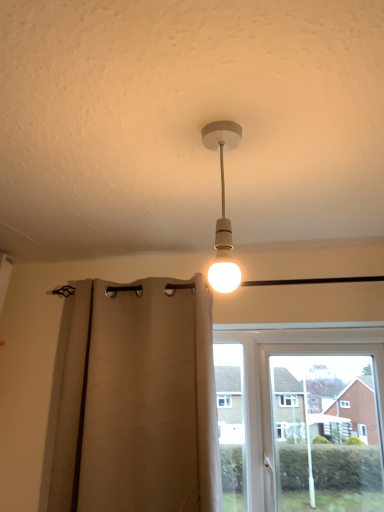
Describe the element at coordinates (308, 415) in the screenshot. This screenshot has height=512, width=384. I see `white plastic window at center` at that location.

Where is `beige fabric curtain at center`? Image resolution: width=384 pixels, height=512 pixels. beige fabric curtain at center is located at coordinates (137, 401).

You are a GUI agent. You are given a task and a screenshot of the screen. Output one action in this format:
    pyautogui.click(x=<x>, y=<y>)
    Task: Click on the white matte bulb at center
    
    Given the screenshot: What is the action you would take?
    pyautogui.click(x=223, y=209)

Is beige fabric curtain at center shorter than white plastic window at center?

Incorrect, the height of beige fabric curtain at center does not fall short of that of white plastic window at center.

Identify the location of window below the beige fabric curtain at center (from the image's perspective). (308, 415).

From the picture: Does beige fabric curtain at center turn towards white plastic window at center?

No, beige fabric curtain at center is not turned towards white plastic window at center.

Is white matte bulb at center inside the boundaries of white plastic window at center, or outside?

white matte bulb at center exists outside the volume of white plastic window at center.

In the image, is white matte bulb at center on the left side or the right side of white plastic window at center?

white matte bulb at center is positioned on white plastic window at center's left side.

Can you confirm if white matte bulb at center is thinner than white plastic window at center?

Yes, white matte bulb at center is thinner than white plastic window at center.

At what (x,y) coordinates should I click in order to perform the action: click on lamp located on the left of white plastic window at center. Please return your answer as a coordinate pair (x, y). Looking at the image, I should click on (223, 209).

Does white matte bulb at center turn towards beige fabric curtain at center?

No, white matte bulb at center is not turned towards beige fabric curtain at center.

Is white matte bulb at center located outside beige fabric curtain at center?

Yes, white matte bulb at center is located beyond the bounds of beige fabric curtain at center.

Is white matte bulb at center wider than beige fabric curtain at center?

Incorrect, the width of white matte bulb at center does not surpass that of beige fabric curtain at center.

Is white plastic window at center oriented away from white matte bulb at center?

white plastic window at center is not turned away from white matte bulb at center.

Between white plastic window at center and white matte bulb at center, which one is positioned in front?

white matte bulb at center.

Between white plastic window at center and white matte bulb at center, which one has less height?

white matte bulb at center is shorter.

Is beige fabric curtain at center positioned behind white matte bulb at center?

Yes, beige fabric curtain at center is further from the camera.

Looking at this image, from the image's perspective, is beige fabric curtain at center over white matte bulb at center?

No, from the image's perspective, beige fabric curtain at center is not over white matte bulb at center.

How much distance is there between beige fabric curtain at center and white matte bulb at center?

beige fabric curtain at center and white matte bulb at center are 36.39 inches apart from each other.

Between beige fabric curtain at center and white matte bulb at center, which one has smaller size?

With smaller size is white matte bulb at center.

Where is `curtain lying above the white plastic window at center (from the image's perspective)`? The image size is (384, 512). curtain lying above the white plastic window at center (from the image's perspective) is located at coordinates (137, 401).

Is beige fabric curtain at center at the back of white plastic window at center?

That's not correct — white plastic window at center is not looking away from beige fabric curtain at center.

Is white plastic window at center in contact with beige fabric curtain at center?

white plastic window at center and beige fabric curtain at center are not in contact.

This screenshot has width=384, height=512. What are the coordinates of `window located underneath the beige fabric curtain at center (from a real-world perspective)` in the screenshot? It's located at (308, 415).

You are a GUI agent. You are given a task and a screenshot of the screen. Output one action in this format:
    pyautogui.click(x=<x>, y=<y>)
    Task: Click on the lamp that is on the left side of white plastic window at center
    The image size is (384, 512).
    Given the screenshot: What is the action you would take?
    pyautogui.click(x=223, y=209)

Based on their spatial positions, is white plastic window at center or beige fabric curtain at center closer to white matte bulb at center?

beige fabric curtain at center.

Estimate the real-world distances between objects in this image. Which object is closer to beige fabric curtain at center, white matte bulb at center or white plastic window at center?

Among the two, white plastic window at center is located nearer to beige fabric curtain at center.

From the image, which object appears to be nearer to white matte bulb at center, beige fabric curtain at center or white plastic window at center?

beige fabric curtain at center is closer to white matte bulb at center.

Which object lies nearer to the anchor point white plastic window at center, beige fabric curtain at center or white matte bulb at center?

beige fabric curtain at center.

Based on the photo, which object lies further to the anchor point beige fabric curtain at center, white plastic window at center or white matte bulb at center?

white matte bulb at center lies further to beige fabric curtain at center than the other object.

Consider the image. From the image, which object appears to be farther from white plastic window at center, white matte bulb at center or beige fabric curtain at center?

white matte bulb at center is further to white plastic window at center.

At what (x,y) coordinates should I click in order to perform the action: click on curtain between white matte bulb at center and white plastic window at center in the vertical direction. Please return your answer as a coordinate pair (x, y). The image size is (384, 512). Looking at the image, I should click on (137, 401).